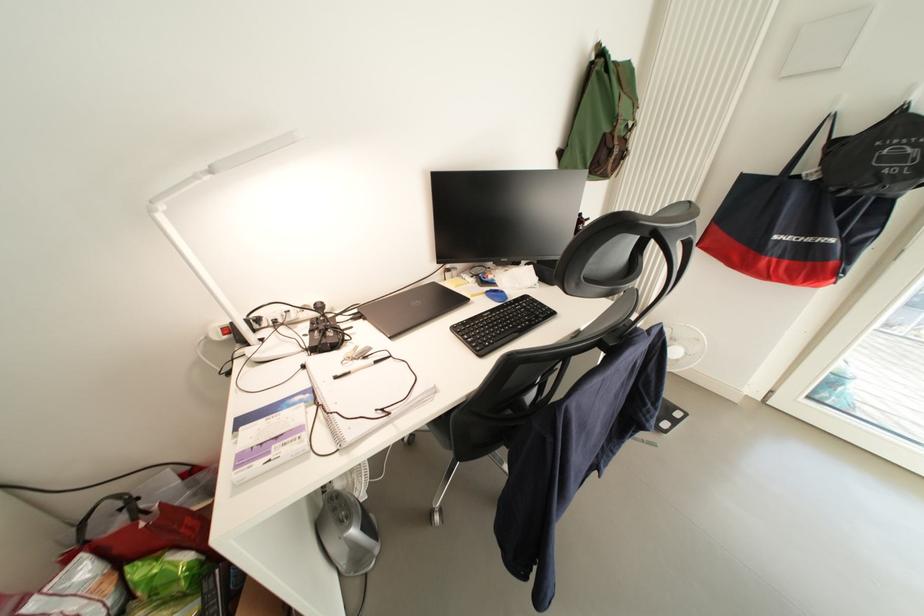
The height and width of the screenshot is (616, 924). Describe the element at coordinates (833, 131) in the screenshot. I see `the black bag handle` at that location.